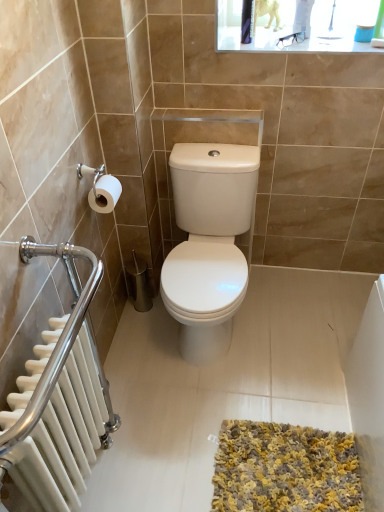
Question: Is white matte toilet paper at left bigger or smaller than white metallic radiator at left?

Choices:
 (A) big
 (B) small

Answer: (B)

Question: Considering the positions of white matte toilet paper at left and white metallic radiator at left in the image, is white matte toilet paper at left wider or thinner than white metallic radiator at left?

Choices:
 (A) thin
 (B) wide

Answer: (A)

Question: Estimate the real-world distances between objects in this image. Which object is closer to the white metallic radiator at left?

Choices:
 (A) white matte toilet paper at left
 (B) yellow-grey shaggy bath mat at lower center

Answer: (B)

Question: Which object is the closest to the white matte toilet paper at left?

Choices:
 (A) yellow-grey shaggy bath mat at lower center
 (B) white metallic radiator at left

Answer: (B)